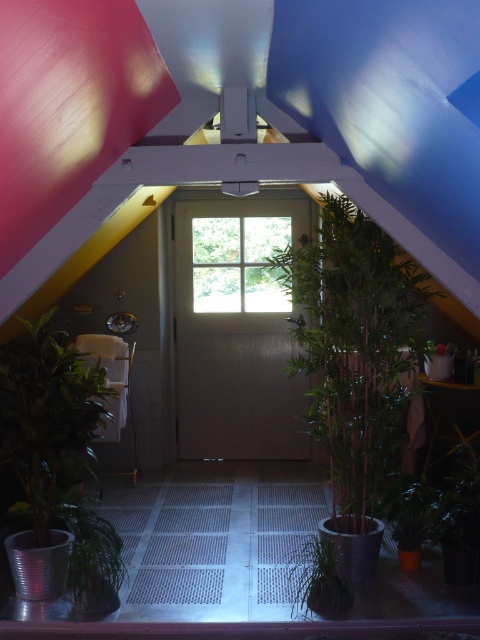
You are a visitor in this space and want to take a photo of both the green bamboo at center and the green leafy plant at left. Which one should you focus on first if you want to include both in the frame without moving the camera?

You should focus on the green bamboo at center first because it is taller than the green leafy plant at left, so adjusting the camera angle to capture its full height will naturally include the shorter plant in the frame.